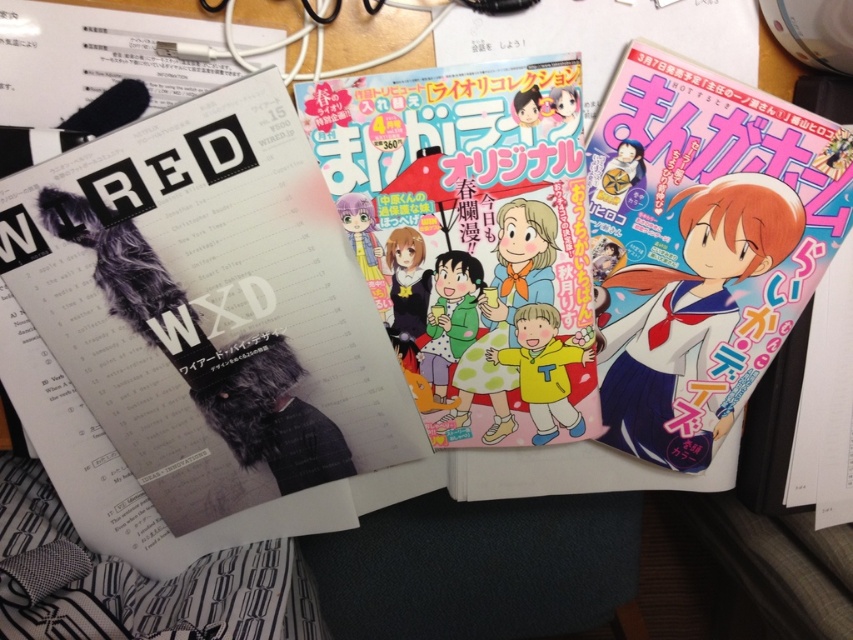
Can you confirm if matte black magazine at left is taller than pastel matte manga at center?

Correct, matte black magazine at left is much taller as pastel matte manga at center.

Is matte black magazine at left to the left of pastel matte manga at center from the viewer's perspective?

Correct, you'll find matte black magazine at left to the left of pastel matte manga at center.

Between point (161, 397) and point (456, 275), which one is positioned behind?

Point (456, 275)

Where is `matte black magazine at left`? Image resolution: width=853 pixels, height=640 pixels. matte black magazine at left is located at coordinates (199, 337).

The height and width of the screenshot is (640, 853). I want to click on matte black magazine at left, so click(199, 337).

Locate an element on the screen. matte black magazine at left is located at coordinates (199, 337).

Can you confirm if pastel matte manga at center is wider than matte white manga at right?

Correct, the width of pastel matte manga at center exceeds that of matte white manga at right.

Measure the distance between point (x=532, y=225) and camera.

Point (x=532, y=225) is 20.25 inches from camera.

Find the location of a particular element. This screenshot has height=640, width=853. pastel matte manga at center is located at coordinates (471, 237).